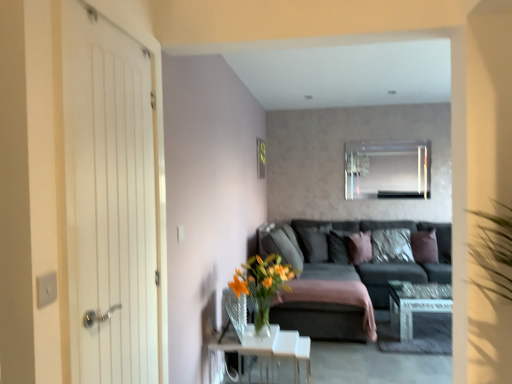
Question: Would you consider white wooden door at left to be distant from metallic gold picture frame at upper center?

Choices:
 (A) no
 (B) yes

Answer: (B)

Question: From the image's perspective, is white wooden door at left over metallic gold picture frame at upper center?

Choices:
 (A) yes
 (B) no

Answer: (B)

Question: Is white wooden door at left closer to camera compared to metallic gold picture frame at upper center?

Choices:
 (A) yes
 (B) no

Answer: (A)

Question: Is white wooden door at left looking in the opposite direction of metallic gold picture frame at upper center?

Choices:
 (A) no
 (B) yes

Answer: (A)

Question: Can you confirm if white wooden door at left is positioned to the right of metallic gold picture frame at upper center?

Choices:
 (A) no
 (B) yes

Answer: (A)

Question: From a real-world perspective, is white wooden door at left positioned over metallic gold picture frame at upper center based on gravity?

Choices:
 (A) no
 (B) yes

Answer: (A)

Question: Is white glossy table at center, which appears as the first table when viewed from the right, at the back of dark gray fabric pillow at center, the 2th pillow from the left?

Choices:
 (A) yes
 (B) no

Answer: (B)

Question: From a real-world perspective, is dark gray fabric pillow at center, the 2th pillow from the left, physically above white glossy table at center, the second table when ordered from left to right?

Choices:
 (A) no
 (B) yes

Answer: (B)

Question: Could you tell me if dark gray fabric pillow at center, the 2th pillow from the left, is turned towards white glossy table at center, placed as the 1th table when sorted from back to front?

Choices:
 (A) yes
 (B) no

Answer: (B)

Question: Can you see dark gray fabric pillow at center, the 2th pillow from the left, touching white glossy table at center, which appears as the first table when viewed from the right?

Choices:
 (A) no
 (B) yes

Answer: (A)

Question: From the image's perspective, is dark gray fabric pillow at center, the 2th pillow from the left, below white glossy table at center, which is the second table from front to back?

Choices:
 (A) yes
 (B) no

Answer: (B)

Question: Can you confirm if dark gray fabric pillow at center, placed as the 4th pillow when sorted from right to left, is positioned to the right of white glossy table at center, the second table when ordered from left to right?

Choices:
 (A) yes
 (B) no

Answer: (B)

Question: Is dark gray fabric couch at center a part of clear glass table at lower center, which is the second table in back-to-front order?

Choices:
 (A) no
 (B) yes

Answer: (A)